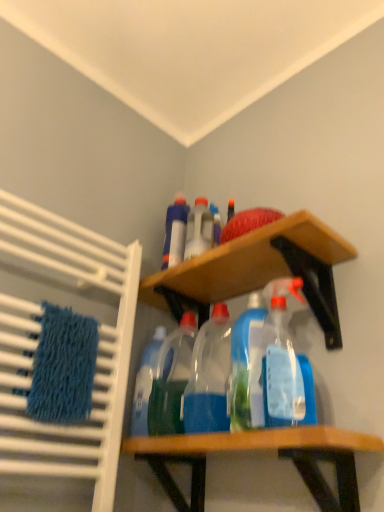
You are a GUI agent. You are given a task and a screenshot of the screen. Output one action in this format:
    pyautogui.click(x=<x>, y=<y>)
    Task: Click on the translucent plastic spray bottle at upper center, placed as the fourth bottle when sorted from front to back
    This screenshot has height=512, width=384.
    Given the screenshot: What is the action you would take?
    [175, 233]

The image size is (384, 512). Describe the element at coordinates (282, 360) in the screenshot. I see `transparent plastic spray bottle at center, the first cleaning product when ordered from right to left` at that location.

Identify the location of wooden shelf at upper center, the second shelf from the bottom. Image resolution: width=384 pixels, height=512 pixels. (258, 271).

What is the approximate height of translucent plastic bottle at center, the 2th bottle when ordered from front to back?

It is 10.96 inches.

I want to click on translucent plastic spray bottle at center, the 3th bottle when ordered from front to back, so click(x=199, y=229).

Find the location of a particular element. translucent plastic spray bottle at upper center, placed as the fourth bottle when sorted from front to back is located at coordinates (175, 233).

From the image's perspective, count 2nd shelfs downward from the translucent plastic spray bottle at center, the 3th bottle when ordered from front to back, and point to it. Please provide its 2D coordinates.

[(261, 449)]

Is translucent plastic spray bottle at center, the second bottle from the back, oriented towards wooden shelf at center, acting as the 2th shelf starting from the top?

No, translucent plastic spray bottle at center, the second bottle from the back, is not oriented towards wooden shelf at center, acting as the 2th shelf starting from the top.

Considering the sizes of translucent plastic spray bottle at center, the second bottle from the back, and wooden shelf at center, the first shelf positioned from the bottom, in the image, is translucent plastic spray bottle at center, the second bottle from the back, bigger or smaller than wooden shelf at center, the first shelf positioned from the bottom,?

In the image, translucent plastic spray bottle at center, the second bottle from the back, appears to be smaller than wooden shelf at center, the first shelf positioned from the bottom.

Choose the correct answer: Is translucent plastic spray bottle at center, the second bottle from the back, inside wooden shelf at center, the first shelf positioned from the bottom, or outside it?

translucent plastic spray bottle at center, the second bottle from the back, cannot be found inside wooden shelf at center, the first shelf positioned from the bottom.

Does translucent plastic spray bottle at center, placed as the second cleaning product when sorted from right to left, lie in front of blue textured bath towel at left?

Yes.

Can you confirm if translucent plastic spray bottle at center, which appears as the 1th cleaning product when viewed from the left, is wider than blue textured bath towel at left?

Yes.

Are translucent plastic spray bottle at center, placed as the second cleaning product when sorted from right to left, and blue textured bath towel at left located far from each other?

translucent plastic spray bottle at center, placed as the second cleaning product when sorted from right to left, is near blue textured bath towel at left, not far away.

From the image's perspective, which one is positioned higher, translucent plastic spray bottle at center, placed as the second cleaning product when sorted from right to left, or blue textured bath towel at left?

translucent plastic spray bottle at center, placed as the second cleaning product when sorted from right to left, is shown above in the image.

Is translucent plastic spray bottle at center, which appears as the 1th cleaning product when viewed from the left, closer to camera compared to transparent plastic spray bottle at center, the first cleaning product when ordered from right to left?

No, it is not.

How different are the orientations of translucent plastic spray bottle at center, which appears as the 1th cleaning product when viewed from the left, and transparent plastic spray bottle at center, the 2th cleaning product viewed from the left, in degrees?

2.13 degrees.

You are a GUI agent. You are given a task and a screenshot of the screen. Output one action in this format:
    pyautogui.click(x=<x>, y=<y>)
    Task: Click on the cleaning product that appears on the right of translucent plastic spray bottle at center, placed as the second cleaning product when sorted from right to left
    Image resolution: width=384 pixels, height=512 pixels.
    Given the screenshot: What is the action you would take?
    pyautogui.click(x=282, y=360)

Is translucent plastic spray bottle at center, placed as the second cleaning product when sorted from right to left, not within transparent plastic spray bottle at center, the 2th cleaning product viewed from the left?

Yes, translucent plastic spray bottle at center, placed as the second cleaning product when sorted from right to left, is located beyond the bounds of transparent plastic spray bottle at center, the 2th cleaning product viewed from the left.

Considering the points (200, 252) and (70, 337), which point is behind, point (200, 252) or point (70, 337)?

The point (200, 252) is farther.

What's the angular difference between translucent plastic spray bottle at center, the second bottle from the back, and blue textured bath towel at left's facing directions?

The facing directions of translucent plastic spray bottle at center, the second bottle from the back, and blue textured bath towel at left are 55.9 degrees apart.

Is translucent plastic spray bottle at center, the second bottle from the back, wider than blue textured bath towel at left?

Indeed, translucent plastic spray bottle at center, the second bottle from the back, has a greater width compared to blue textured bath towel at left.

From a real-world perspective, is translucent plastic spray bottle at center, the 3th bottle when ordered from front to back, below blue textured bath towel at left?

Incorrect, from a real-world perspective, translucent plastic spray bottle at center, the 3th bottle when ordered from front to back, is higher than blue textured bath towel at left.

Is wooden shelf at upper center, the 1th shelf in the top-to-bottom sequence, inside translucent plastic bottle at center, positioned as the third bottle in back-to-front order?

No, wooden shelf at upper center, the 1th shelf in the top-to-bottom sequence, is not surrounded by translucent plastic bottle at center, positioned as the third bottle in back-to-front order.

Is translucent plastic bottle at center, positioned as the third bottle in back-to-front order, facing towards wooden shelf at upper center, the 1th shelf in the top-to-bottom sequence?

No, translucent plastic bottle at center, positioned as the third bottle in back-to-front order, is not turned towards wooden shelf at upper center, the 1th shelf in the top-to-bottom sequence.

Does point (183, 385) appear closer or farther from the camera than point (273, 249)?

Clearly, point (183, 385) is more distant from the camera than point (273, 249).

Who is more distant, translucent plastic bottle at center, the 2th bottle when ordered from front to back, or wooden shelf at upper center, the second shelf from the bottom?

translucent plastic bottle at center, the 2th bottle when ordered from front to back, is behind.

Is transparent plastic bottles at center, which appears as the first bottle when viewed from the front, taller or shorter than transparent plastic spray bottle at center, the first cleaning product when ordered from right to left?

In the image, transparent plastic bottles at center, which appears as the first bottle when viewed from the front, appears to be shorter than transparent plastic spray bottle at center, the first cleaning product when ordered from right to left.

Is transparent plastic bottles at center, which appears as the first bottle when viewed from the front, oriented away from transparent plastic spray bottle at center, the 2th cleaning product viewed from the left?

No, transparent plastic bottles at center, which appears as the first bottle when viewed from the front, is not facing away from transparent plastic spray bottle at center, the 2th cleaning product viewed from the left.

Considering the relative sizes of transparent plastic bottles at center, positioned as the fourth bottle in back-to-front order, and transparent plastic spray bottle at center, the first cleaning product when ordered from right to left, in the image provided, is transparent plastic bottles at center, positioned as the fourth bottle in back-to-front order, bigger than transparent plastic spray bottle at center, the first cleaning product when ordered from right to left,?

Yes.

Is transparent plastic bottles at center, which appears as the first bottle when viewed from the front, positioned beyond the bounds of transparent plastic spray bottle at center, the first cleaning product when ordered from right to left?

Yes.

Is transparent plastic bottles at center, which appears as the first bottle when viewed from the front, not near blue textured bath towel at left?

No, transparent plastic bottles at center, which appears as the first bottle when viewed from the front, is not far away from blue textured bath towel at left.

From the image's perspective, is transparent plastic bottles at center, positioned as the fourth bottle in back-to-front order, beneath blue textured bath towel at left?

Yes.

Is point (212, 399) in front of point (94, 327)?

Yes.

The width and height of the screenshot is (384, 512). In order to click on the 3rd bottle behind the wooden shelf at center, acting as the 2th shelf starting from the top, counting from the anchor's position in this screenshot , I will do `click(199, 229)`.

From a real-world perspective, count 1st cleaning products upward from the blue textured bath towel at left and point to it. Please provide its 2D coordinates.

[(244, 361)]

When comparing their distances from wooden shelf at upper center, the second shelf from the bottom, does translucent plastic spray bottle at center, placed as the second cleaning product when sorted from right to left, or wooden shelf at center, acting as the 2th shelf starting from the top, seem further?

Among the two, wooden shelf at center, acting as the 2th shelf starting from the top, is located further to wooden shelf at upper center, the second shelf from the bottom.

From the image, which object appears to be farther from transparent plastic bottles at center, which appears as the first bottle when viewed from the front, translucent plastic spray bottle at center, the 3th bottle when ordered from front to back, or wooden shelf at center, the first shelf positioned from the bottom?

Based on the image, translucent plastic spray bottle at center, the 3th bottle when ordered from front to back, appears to be further to transparent plastic bottles at center, which appears as the first bottle when viewed from the front.

From the image, which object appears to be nearer to transparent plastic bottles at center, which appears as the first bottle when viewed from the front, blue textured bath towel at left or wooden shelf at upper center, the 1th shelf in the top-to-bottom sequence?

wooden shelf at upper center, the 1th shelf in the top-to-bottom sequence, is positioned closer to the anchor transparent plastic bottles at center, which appears as the first bottle when viewed from the front.

From the picture: Estimate the real-world distances between objects in this image. Which object is closer to transparent plastic spray bottle at center, the first cleaning product when ordered from right to left, translucent plastic spray bottle at center, placed as the second cleaning product when sorted from right to left, or translucent plastic spray bottle at center, the 3th bottle when ordered from front to back?

translucent plastic spray bottle at center, placed as the second cleaning product when sorted from right to left, lies closer to transparent plastic spray bottle at center, the first cleaning product when ordered from right to left, than the other object.

When comparing their distances from transparent plastic spray bottle at center, the first cleaning product when ordered from right to left, does wooden shelf at center, acting as the 2th shelf starting from the top, or translucent plastic bottle at center, positioned as the third bottle in back-to-front order, seem further?

translucent plastic bottle at center, positioned as the third bottle in back-to-front order, is further to transparent plastic spray bottle at center, the first cleaning product when ordered from right to left.

Based on their spatial positions, is transparent plastic spray bottle at center, the 2th cleaning product viewed from the left, or translucent plastic bottle at center, positioned as the third bottle in back-to-front order, further from blue textured bath towel at left?

transparent plastic spray bottle at center, the 2th cleaning product viewed from the left, lies further to blue textured bath towel at left than the other object.

Considering their positions, is wooden shelf at upper center, the second shelf from the bottom, positioned further to translucent plastic bottle at center, positioned as the third bottle in back-to-front order, than translucent plastic spray bottle at center, the second bottle from the back?

The object further to translucent plastic bottle at center, positioned as the third bottle in back-to-front order, is translucent plastic spray bottle at center, the second bottle from the back.

Which object lies further to the anchor point translucent plastic bottle at center, positioned as the third bottle in back-to-front order, wooden shelf at center, acting as the 2th shelf starting from the top, or wooden shelf at upper center, the second shelf from the bottom?

wooden shelf at upper center, the second shelf from the bottom, is further to translucent plastic bottle at center, positioned as the third bottle in back-to-front order.

At what (x,y) coordinates should I click in order to perform the action: click on shelf situated between blue textured bath towel at left and wooden shelf at upper center, the second shelf from the bottom, from left to right. Please return your answer as a coordinate pair (x, y). This screenshot has height=512, width=384. Looking at the image, I should click on (261, 449).

Image resolution: width=384 pixels, height=512 pixels. In order to click on cleaning product located between transparent plastic spray bottle at center, the 2th cleaning product viewed from the left, and translucent plastic spray bottle at upper center, placed as the first bottle when sorted from back to front, in the depth direction in this screenshot , I will do `click(244, 361)`.

Image resolution: width=384 pixels, height=512 pixels. I want to click on cleaning product between translucent plastic bottle at center, the 2th bottle when ordered from front to back, and transparent plastic spray bottle at center, the 2th cleaning product viewed from the left, so click(244, 361).

Identify the location of bottle between wooden shelf at center, acting as the 2th shelf starting from the top, and translucent plastic bottle at center, positioned as the third bottle in back-to-front order, from front to back. (209, 376).